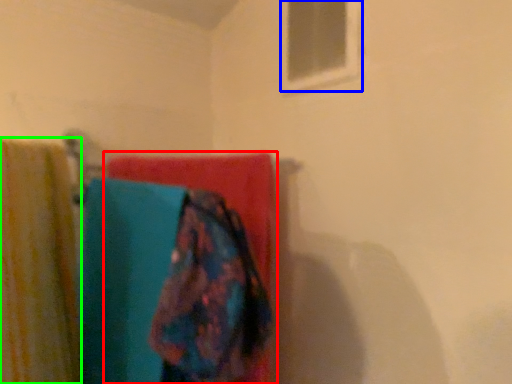
Question: Which is farther away from towel (highlighted by a red box)? window (highlighted by a blue box) or curtain (highlighted by a green box)?

Choices:
 (A) window
 (B) curtain

Answer: (A)